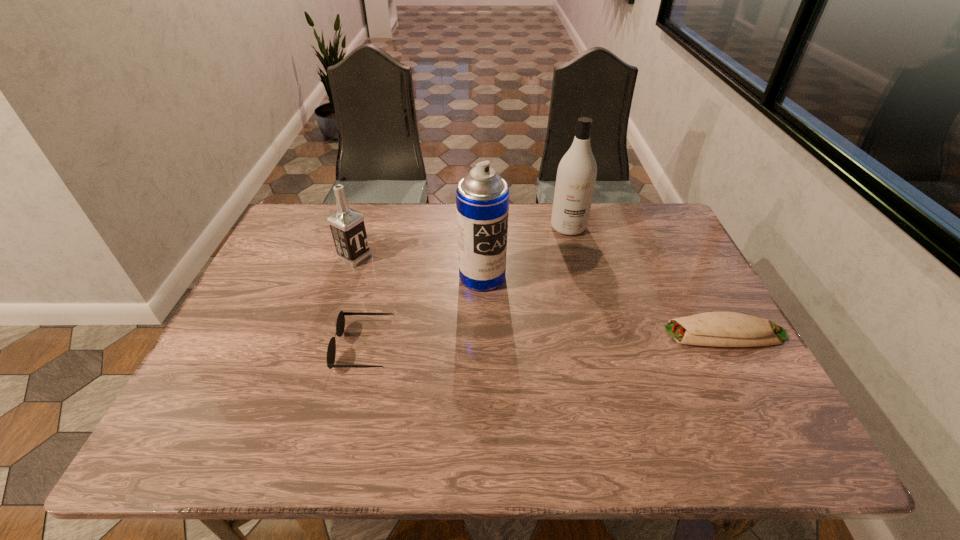
This screenshot has height=540, width=960. Find the location of `vacant space on the desktop that is between the sunglasses and the rightmost object and is positioned on the front label of the third tallest object`. vacant space on the desktop that is between the sunglasses and the rightmost object and is positioned on the front label of the third tallest object is located at coordinates (521, 341).

Locate an element on the screen. The image size is (960, 540). free spot on the desktop that is between the sunglasses and the burrito and is positioned on the label side of the aerosol can is located at coordinates (566, 340).

Image resolution: width=960 pixels, height=540 pixels. What are the coordinates of `vacant space on the desktop that is between the sunglasses and the shortest object and is positioned on the front-facing side of the shampoo` in the screenshot? It's located at (581, 339).